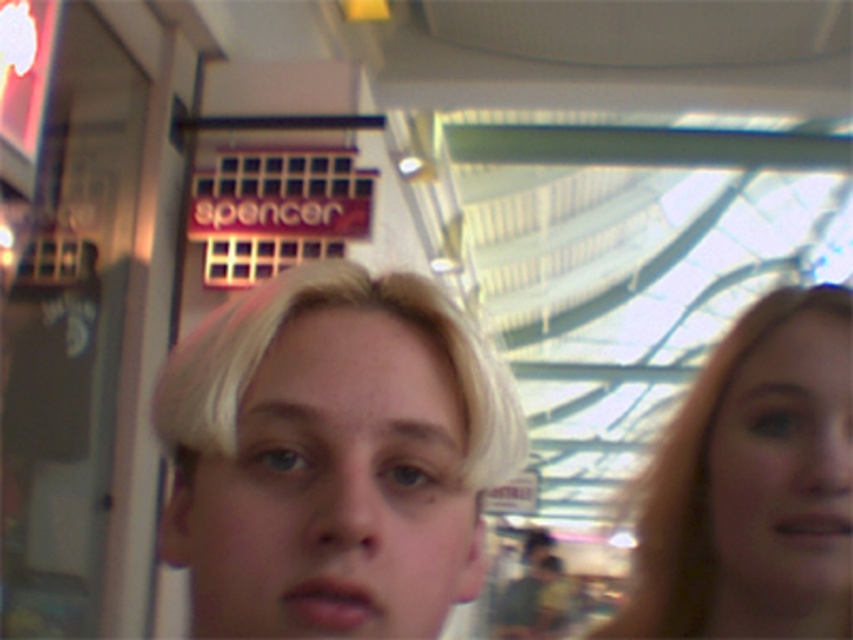
Question: Can you confirm if blonde hair at center is positioned below blonde hair at right?

Choices:
 (A) no
 (B) yes

Answer: (A)

Question: From the image, what is the correct spatial relationship of blonde hair at center in relation to blonde hair at right?

Choices:
 (A) above
 (B) below

Answer: (A)

Question: From the image, what is the correct spatial relationship of blonde hair at center in relation to blonde hair at right?

Choices:
 (A) right
 (B) left

Answer: (B)